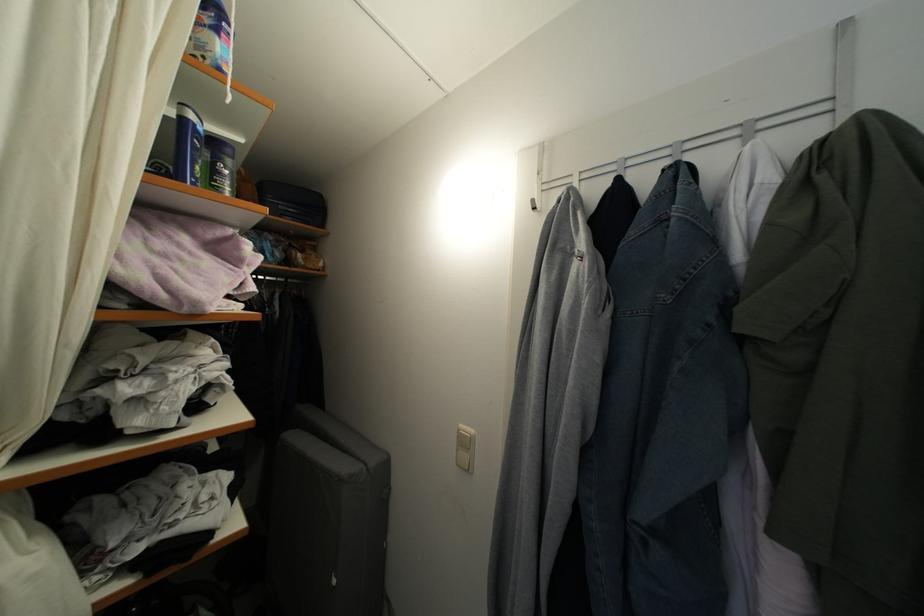
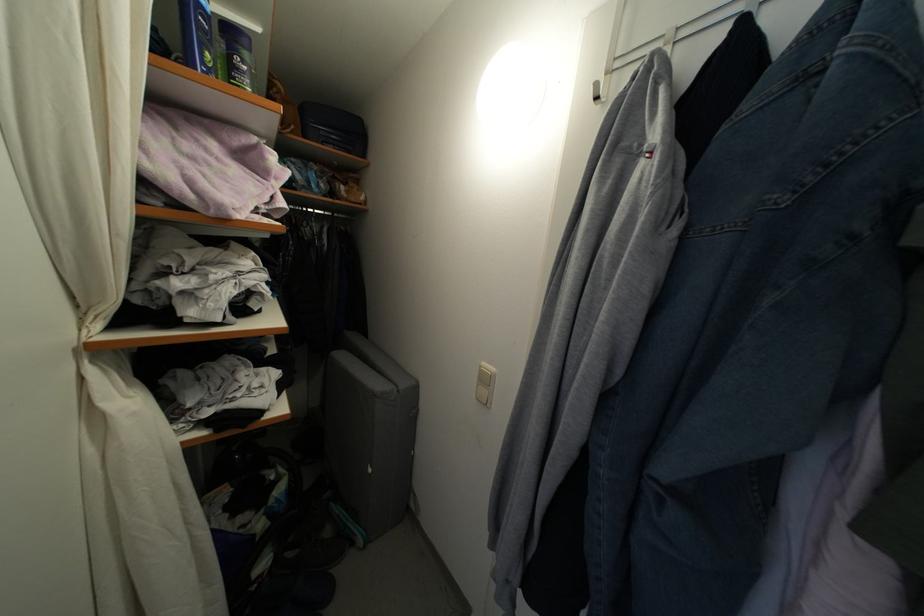
Find the pixel in the second image that matches the point at 467,432 in the first image.

(489, 370)